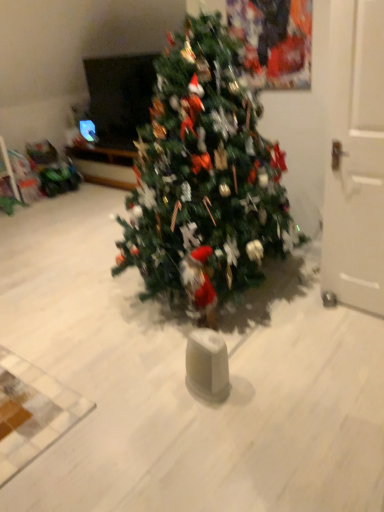
At what (x,y) coordinates should I click in order to perform the action: click on free space to the left of white matte door at right. Please return your answer as a coordinate pair (x, y). The width and height of the screenshot is (384, 512). Looking at the image, I should click on (300, 313).